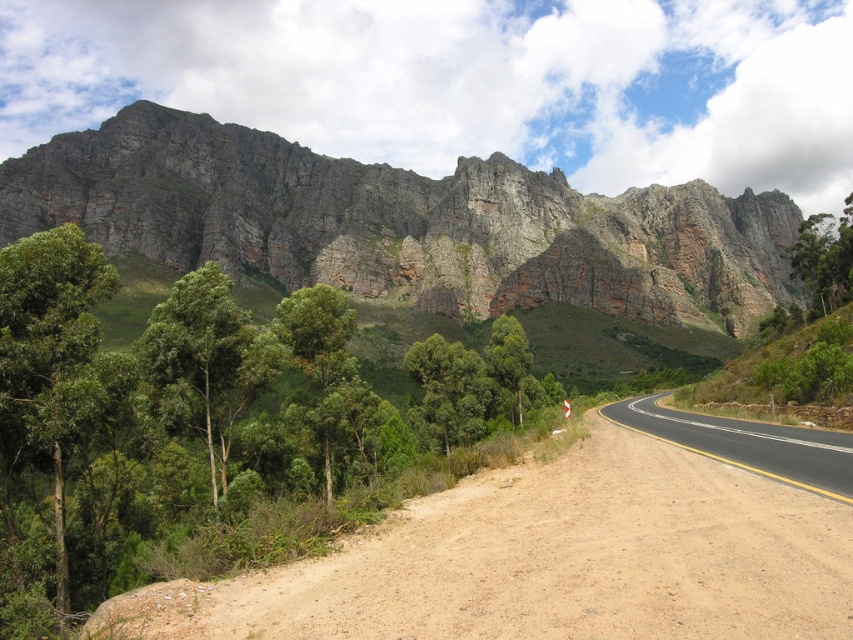
You are a hiker planning to walk along the dirt road at lower left and pass by the green leafy tree at left. Considering their heights, which one will you have to look up more to see?

The green leafy tree at left has a greater height compared to the dirt road at lower left, so you will have to look up more to see the green leafy tree at left.

From the picture: You are a hiker planning to take a photo of both the green smooth tree at center and the green leafy tree at right. Since you want them both in the frame, which tree should you position closer to the camera to ensure both are fully visible?

To include both the green smooth tree at center and the green leafy tree at right in the photo, position yourself closer to the green smooth tree at center since it is smaller in size compared to the green leafy tree at right. This way, the smaller tree will appear larger in the frame, balancing their sizes and ensuring both are fully visible.

You are a hiker planning to walk from the dirt road at lower left to the green smooth tree at center. According to the scene, which direction should you head to reach the tree?

The dirt road at lower left is positioned under the green smooth tree at center, so you should head upwards to reach the tree from the road.